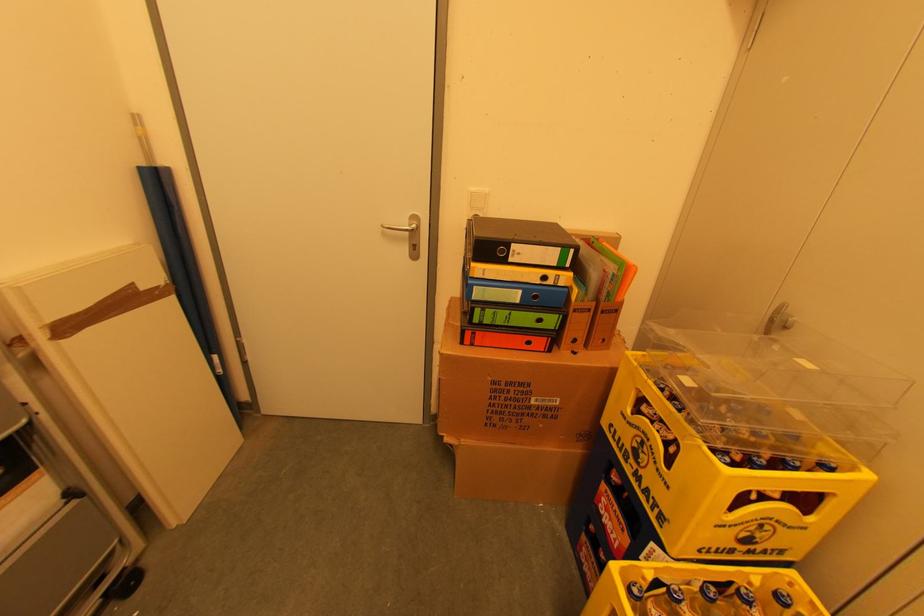
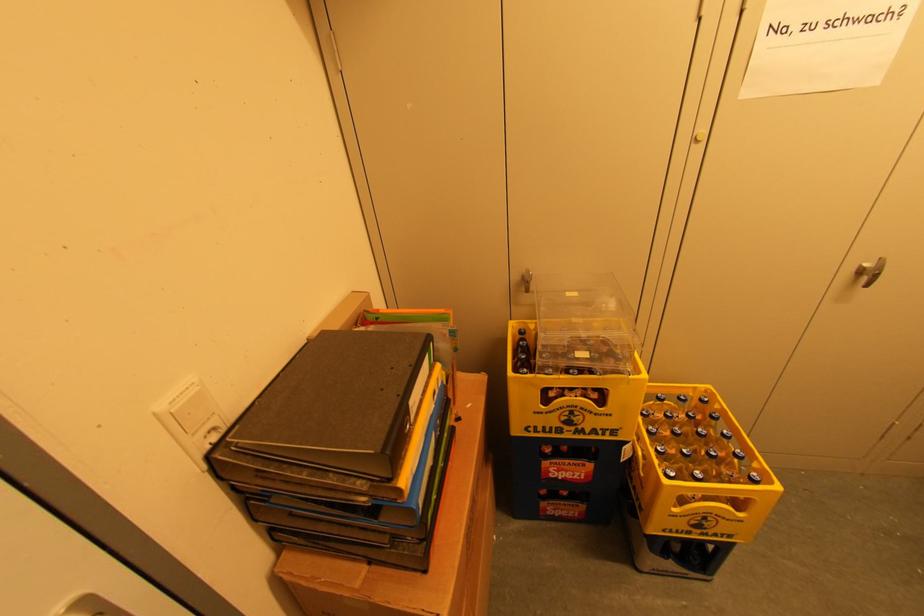
The point at (x=553, y=282) is marked in the first image. Where is the corresponding point in the second image?

(440, 392)